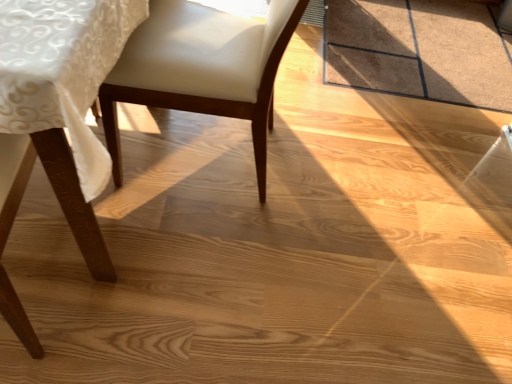
Where is `free space in front of white leather chair at center, the 1th chair from the right`? The image size is (512, 384). free space in front of white leather chair at center, the 1th chair from the right is located at coordinates point(217,283).